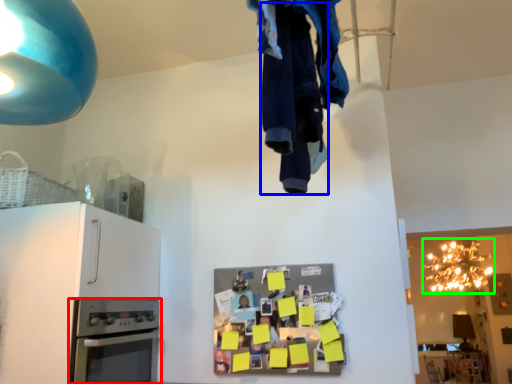
Question: Estimate the real-world distances between objects in this image. Which object is farther from home appliance (highlighted by a red box), clothing (highlighted by a blue box) or lamp (highlighted by a green box)?

Choices:
 (A) clothing
 (B) lamp

Answer: (B)